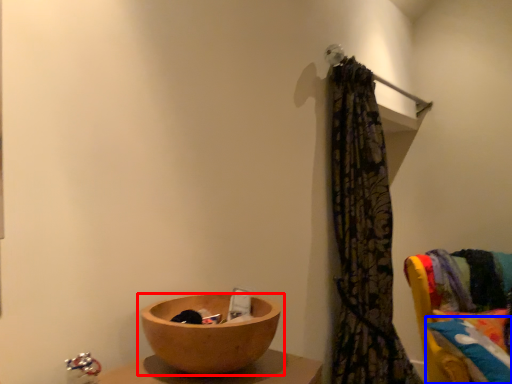
Question: Which of the following is the farthest to the observer, tableware (highlighted by a red box) or pillow (highlighted by a blue box)?

Choices:
 (A) tableware
 (B) pillow

Answer: (B)